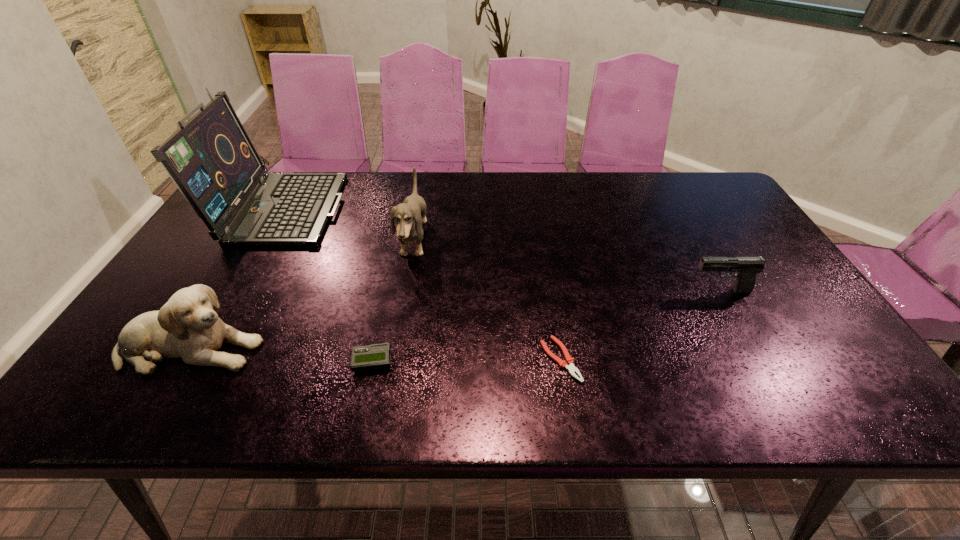
At what (x,y) coordinates should I click in order to perform the action: click on empty space that is in between the pliers and the right puppy. Please return your answer as a coordinate pair (x, y). Looking at the image, I should click on (487, 301).

Locate an element on the screen. This screenshot has width=960, height=540. free space between the beeper and the tallest object is located at coordinates (328, 284).

The width and height of the screenshot is (960, 540). In order to click on vacant region between the pliers and the farther puppy in this screenshot , I will do `click(487, 301)`.

I want to click on vacant space in between the tallest object and the beeper, so click(328, 284).

Locate an element on the screen. This screenshot has height=540, width=960. free space between the right puppy and the pliers is located at coordinates (487, 301).

You are a GUI agent. You are given a task and a screenshot of the screen. Output one action in this format:
    pyautogui.click(x=<x>, y=<y>)
    Task: Click on the empty space that is in between the right puppy and the shortest object
    The image size is (960, 540).
    Given the screenshot: What is the action you would take?
    pyautogui.click(x=487, y=301)

I want to click on unoccupied position between the second shortest object and the farther puppy, so click(393, 301).

The width and height of the screenshot is (960, 540). I want to click on unoccupied area between the tallest object and the left puppy, so point(237,277).

Locate an element on the screen. empty space between the third farthest object and the fifth object from left to right is located at coordinates (640, 326).

Where is `free space between the fourth nearest object and the fifth tallest object`? free space between the fourth nearest object and the fifth tallest object is located at coordinates (546, 326).